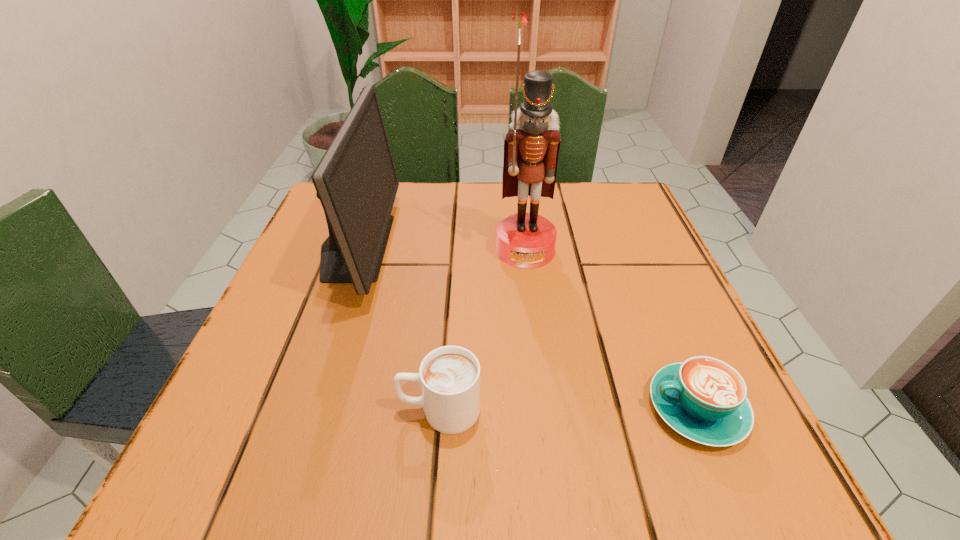
Locate an element on the screen. The width and height of the screenshot is (960, 540). vacant space that satisfies the following two spatial constraints: 1. on the front-facing side of the tallest object; 2. on the side with the handle of the third tallest object is located at coordinates (545, 409).